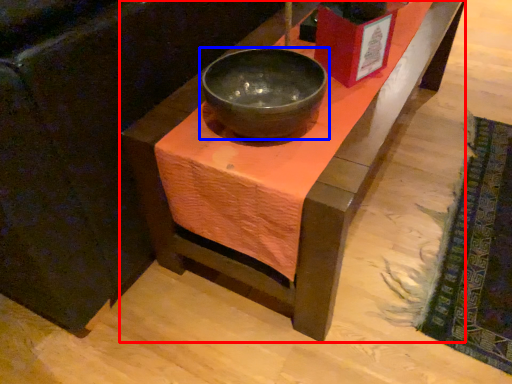
Question: Which point is closer to the camera, table (highlighted by a red box) or bowl (highlighted by a blue box)?

Choices:
 (A) table
 (B) bowl

Answer: (A)